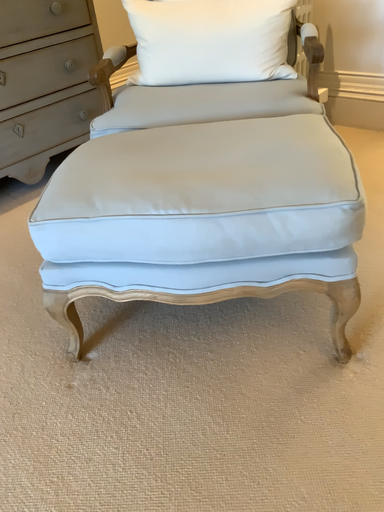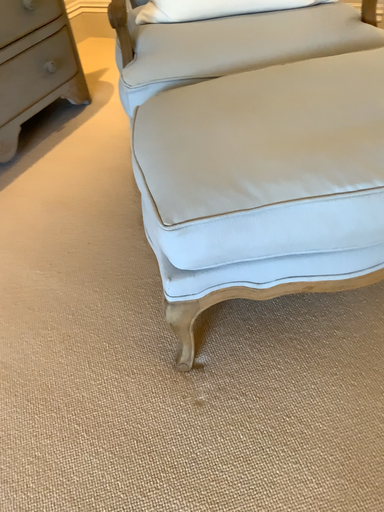
Question: Which way did the camera rotate in the video?

Choices:
 (A) rotated left
 (B) rotated right

Answer: (B)